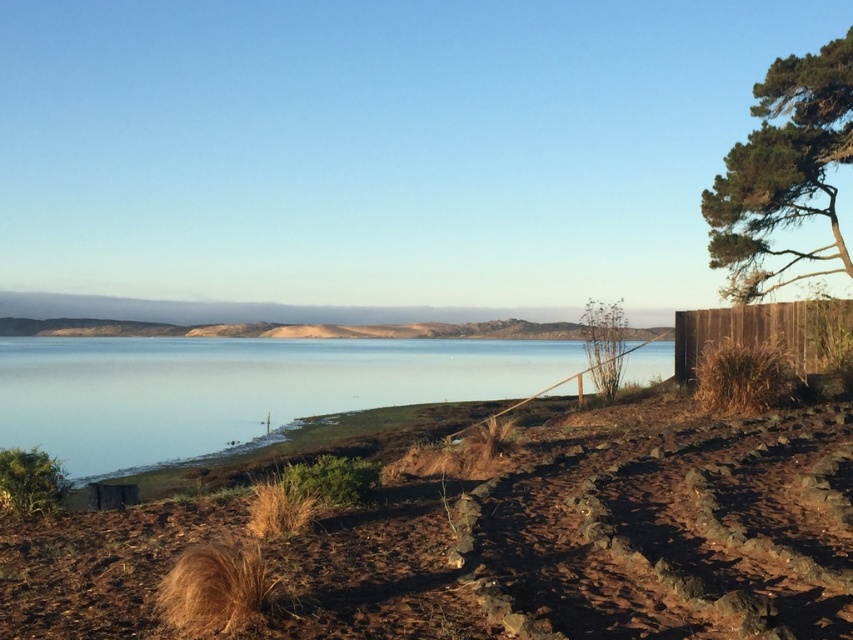
You are standing at the edge of the coastal landscape and want to place two markers at the coordinates given. Which of the two points, point (631, 611) or point (753, 236), is closer to your current position?

Point (631, 611) is closer to the camera than point (753, 236), so it is closer to your current position.

You are standing at the point marked by the coordinates point (236,388) in the image. What type of terrain are you currently on?

The point (236,388) indicates clear water at center, so you are standing on clear water at center.

You are a painter setting up your easel to capture the coastal scene. You want to position yourself so that both the clear water at center and the brown wooden fence at right are visible in your painting. Based on their positions, which object should be placed on the left side of your canvas?

The clear water at center should be placed on the left side of your canvas because it is positioned to the left of the brown wooden fence at right.